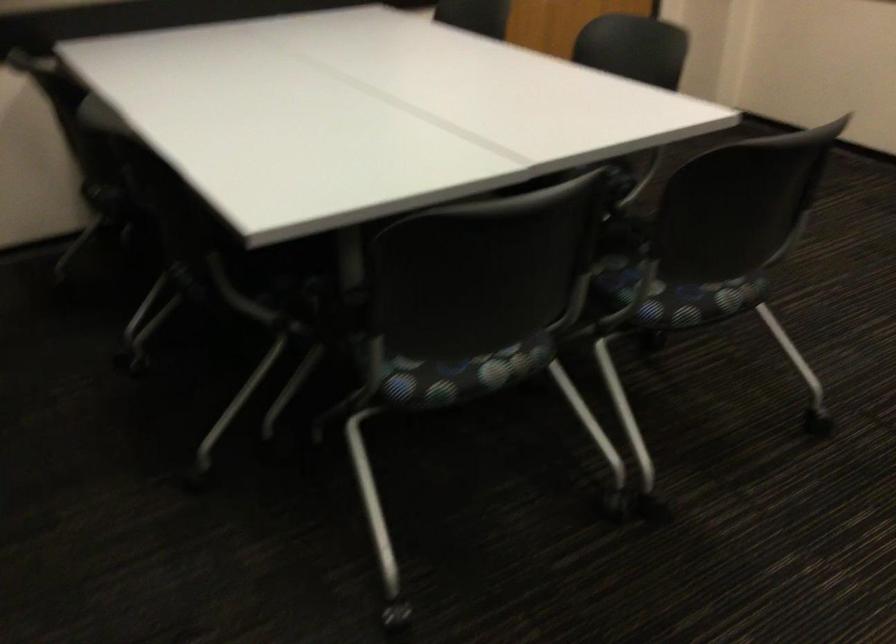
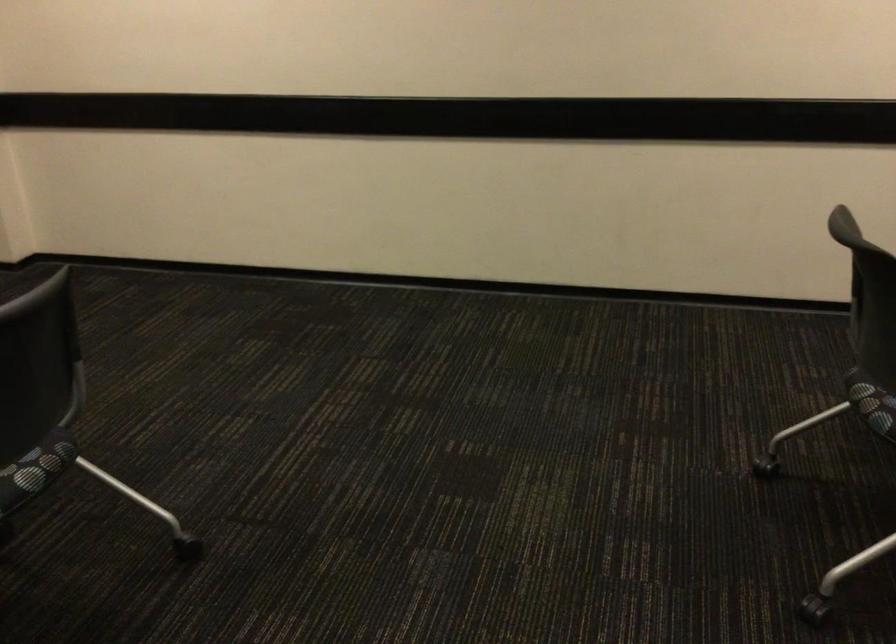
Question: The camera is either moving clockwise (left) or counter-clockwise (right) around the object. The first image is from the beginning of the video and the second image is from the end. Is the camera moving left or right when shooting the video?

Choices:
 (A) Left
 (B) Right

Answer: (A)